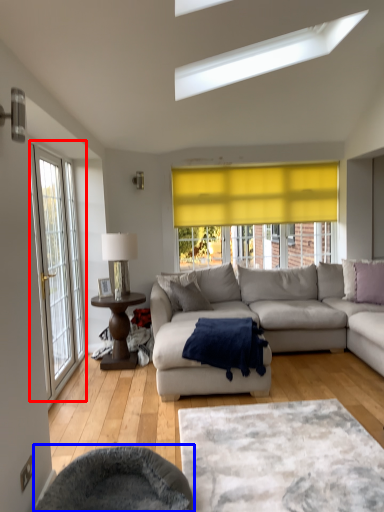
Question: Which object is further to the camera taking this photo, door (highlighted by a red box) or swivel chair (highlighted by a blue box)?

Choices:
 (A) door
 (B) swivel chair

Answer: (A)